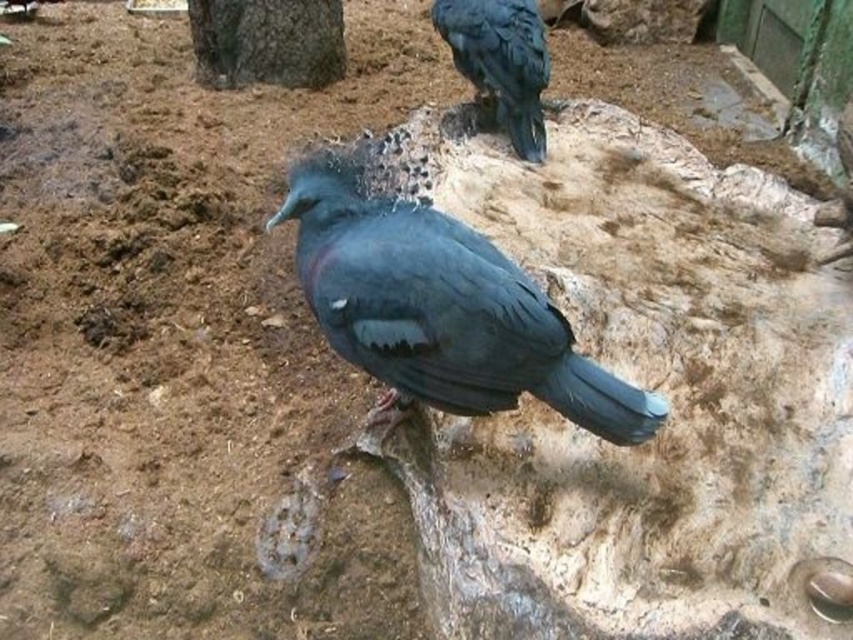
Which is above, shiny blue bird at center or shiny black bird at upper right?

shiny black bird at upper right is higher up.

This screenshot has width=853, height=640. What do you see at coordinates (440, 308) in the screenshot? I see `shiny blue bird at center` at bounding box center [440, 308].

Does point (492, 280) come in front of point (541, 88)?

Yes, it is.

In order to click on shiny blue bird at center in this screenshot , I will do `click(440, 308)`.